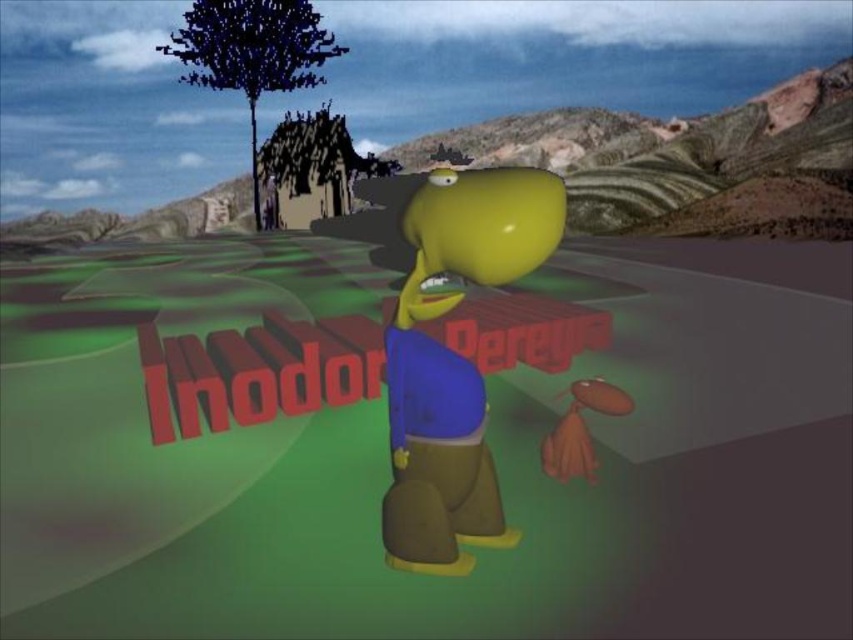
From the picture: Between rubber yellow head at center and dark green textured tree at upper left, which one is positioned lower?

Positioned lower is rubber yellow head at center.

Is the position of rubber yellow head at center more distant than that of dark green textured tree at upper left?

No.

Identify the location of rubber yellow head at center. (454, 358).